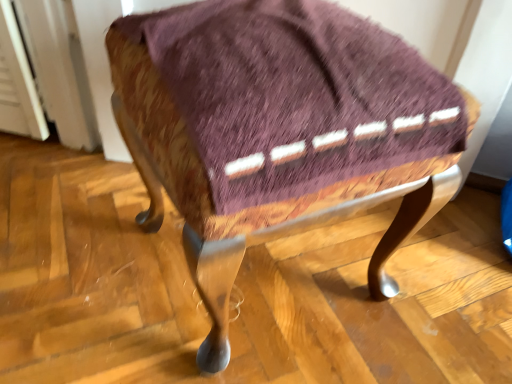
Describe the element at coordinates (280, 131) in the screenshot. This screenshot has height=384, width=512. I see `woven fabric stool at center` at that location.

What is the approximate width of woven fabric stool at center?

16.39 inches.

Where is `woven fabric stool at center`? The width and height of the screenshot is (512, 384). woven fabric stool at center is located at coordinates (280, 131).

The width and height of the screenshot is (512, 384). In order to click on woven fabric stool at center in this screenshot , I will do `click(280, 131)`.